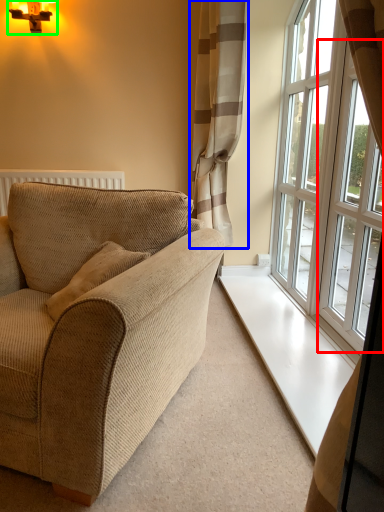
Question: Considering the real-world distances, which object is closest to window (highlighted by a red box)? curtain (highlighted by a blue box) or light fixture (highlighted by a green box).

Choices:
 (A) curtain
 (B) light fixture

Answer: (A)